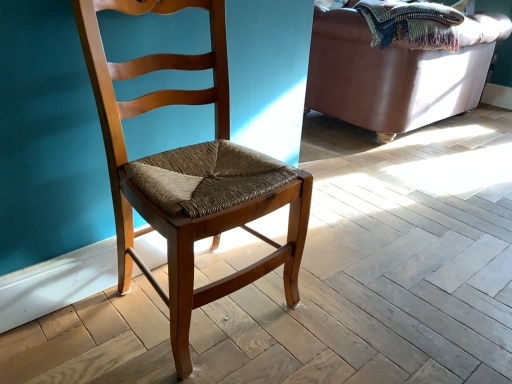
You are a GUI agent. You are given a task and a screenshot of the screen. Output one action in this format:
    pyautogui.click(x=<x>, y=<y>)
    Task: Click on the leather couch at upper right
    The image size is (512, 384).
    Given the screenshot: What is the action you would take?
    pyautogui.click(x=396, y=73)

The width and height of the screenshot is (512, 384). Describe the element at coordinates (396, 73) in the screenshot. I see `leather couch at upper right` at that location.

Image resolution: width=512 pixels, height=384 pixels. What do you see at coordinates (411, 23) in the screenshot? I see `woven multicolored blanket at upper right` at bounding box center [411, 23].

Image resolution: width=512 pixels, height=384 pixels. In order to click on wooden chair at center in this screenshot , I will do `click(181, 212)`.

Is wooden chair at center inside or outside of woven multicolored blanket at upper right?

wooden chair at center exists outside the volume of woven multicolored blanket at upper right.

Is wooden chair at center aimed at woven multicolored blanket at upper right?

No, wooden chair at center is not oriented towards woven multicolored blanket at upper right.

In the scene shown: From a real-world perspective, who is located lower, wooden chair at center or woven multicolored blanket at upper right?

wooden chair at center is physically lower.

From the image's perspective, is wooden chair at center above or below woven multicolored blanket at upper right?

Based on their image positions, wooden chair at center is located beneath woven multicolored blanket at upper right.

Which of these two, woven multicolored blanket at upper right or leather couch at upper right, is wider?

With larger width is leather couch at upper right.

In the scene shown: Is woven multicolored blanket at upper right inside the boundaries of leather couch at upper right, or outside?

woven multicolored blanket at upper right is located inside leather couch at upper right.

Where is `blanket on the left of leather couch at upper right`? Image resolution: width=512 pixels, height=384 pixels. blanket on the left of leather couch at upper right is located at coordinates (411, 23).

From a real-world perspective, which object stands above the other?

woven multicolored blanket at upper right is physically above.

Who is smaller, leather couch at upper right or woven multicolored blanket at upper right?

woven multicolored blanket at upper right.

Considering their positions, is leather couch at upper right located in front of or behind woven multicolored blanket at upper right?

Visually, leather couch at upper right is located behind woven multicolored blanket at upper right.

How many degrees apart are the facing directions of leather couch at upper right and woven multicolored blanket at upper right?

The angular difference between leather couch at upper right and woven multicolored blanket at upper right is 0.000348 degrees.

Which is behind, leather couch at upper right or wooden chair at center?

leather couch at upper right is further away from the camera.

Considering the relative sizes of leather couch at upper right and wooden chair at center in the image provided, is leather couch at upper right wider than wooden chair at center?

Indeed, leather couch at upper right has a greater width compared to wooden chair at center.

Are leather couch at upper right and wooden chair at center beside each other?

No, leather couch at upper right is not with wooden chair at center.

From a real-world perspective, which is physically above, leather couch at upper right or wooden chair at center?

wooden chair at center, from a real-world perspective.

What's the angular difference between wooden chair at center and leather couch at upper right's facing directions?

180 degrees.

From the image's perspective, would you say wooden chair at center is positioned over leather couch at upper right?

A: Actually, wooden chair at center appears below leather couch at upper right in the image.

Would you say wooden chair at center is a long distance from leather couch at upper right?

Indeed, wooden chair at center is not near leather couch at upper right.

Which is nearer, (214, 39) or (343, 13)?

Point (214, 39) is positioned closer to the camera compared to point (343, 13).

Considering the sizes of objects woven multicolored blanket at upper right and wooden chair at center in the image provided, who is bigger, woven multicolored blanket at upper right or wooden chair at center?

Bigger between the two is wooden chair at center.

From the image's perspective, who appears lower, woven multicolored blanket at upper right or wooden chair at center?

wooden chair at center appears lower in the image.

Would you say woven multicolored blanket at upper right contains wooden chair at center?

No, wooden chair at center is not a part of woven multicolored blanket at upper right.

Measure the distance between woven multicolored blanket at upper right and wooden chair at center.

1.55 meters.

Identify the location of chair located in front of the woven multicolored blanket at upper right. (181, 212).

Locate an element on the screen. This screenshot has height=384, width=512. studio couch below the woven multicolored blanket at upper right (from the image's perspective) is located at coordinates (396, 73).

Looking at this image, which object lies further to the anchor point wooden chair at center, leather couch at upper right or woven multicolored blanket at upper right?

Based on the image, leather couch at upper right appears to be further to wooden chair at center.

Estimate the real-world distances between objects in this image. Which object is closer to woven multicolored blanket at upper right, leather couch at upper right or wooden chair at center?

Based on the image, leather couch at upper right appears to be nearer to woven multicolored blanket at upper right.

Based on their spatial positions, is wooden chair at center or leather couch at upper right further from woven multicolored blanket at upper right?

The object further to woven multicolored blanket at upper right is wooden chair at center.

Based on their spatial positions, is wooden chair at center or woven multicolored blanket at upper right further from leather couch at upper right?

Based on the image, wooden chair at center appears to be further to leather couch at upper right.

Considering their positions, is woven multicolored blanket at upper right positioned further to leather couch at upper right than wooden chair at center?

wooden chair at center is further to leather couch at upper right.

From the image, which object appears to be farther from wooden chair at center, woven multicolored blanket at upper right or leather couch at upper right?

leather couch at upper right is further to wooden chair at center.

Locate an element on the screen. blanket located between wooden chair at center and leather couch at upper right in the depth direction is located at coordinates (411, 23).